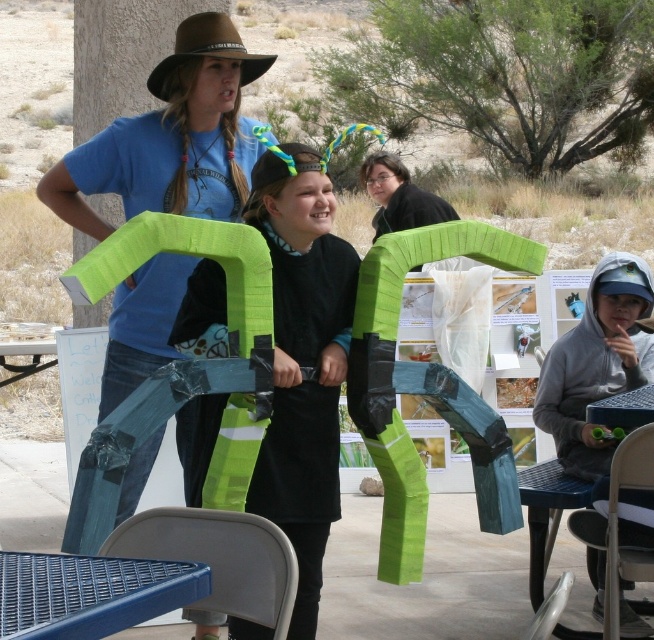
You are a photographer setting up for an event. You need to place a 2.5 meter long banner between the gray hoodie at lower right and the blue plastic table at lower left. Will the banner fit between them?

The gray hoodie at lower right and the blue plastic table at lower left are 2.60 meters apart. Since the banner is 2.5 meters long, it will fit between them with 0.1 meters of space remaining.

You are organizing an outdoor event and need to decide where to place a new banner. The banner must be placed in front of the black felt dress at center but not overlap with the blue plastic table at lower left. Given their sizes, is this possible?

The black felt dress at center is bigger than the blue plastic table at lower left. Since the banner needs to be placed in front of the dress without overlapping the table, it is possible as the dress has a larger area to accommodate the banner while avoiding the smaller table.